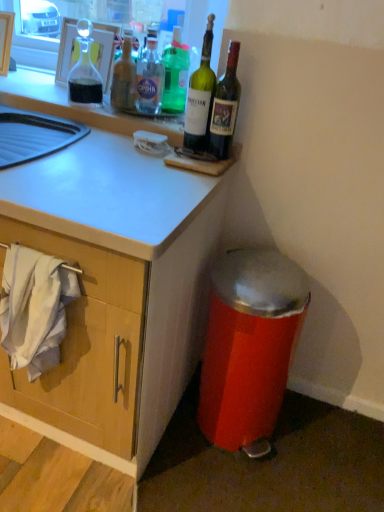
Where is `white fabric at lower left`? This screenshot has height=512, width=384. white fabric at lower left is located at coordinates (35, 308).

The image size is (384, 512). Describe the element at coordinates (35, 308) in the screenshot. I see `white fabric at lower left` at that location.

Locate an element on the screen. The height and width of the screenshot is (512, 384). green glass bottle at upper right, positioned as the 1th bottle in right-to-left order is located at coordinates (225, 106).

What do you see at coordinates (124, 79) in the screenshot? I see `translucent glass bottle at upper center, marked as the 1th bottle in a left-to-right arrangement` at bounding box center [124, 79].

What is the approximate width of white glossy sink at upper left?

The width of white glossy sink at upper left is 19.68 inches.

Image resolution: width=384 pixels, height=512 pixels. Identify the location of clear glass carafe at upper left. 103,49.

Find the location of a particular element. green glass bottle at upper center, the 4th bottle positioned from the left is located at coordinates (200, 97).

In the scene shown: Considering the sizes of green glass bottle at upper center, positioned as the third bottle in left-to-right order, and white fabric at lower left in the image, is green glass bottle at upper center, positioned as the third bottle in left-to-right order, bigger or smaller than white fabric at lower left?

Clearly, green glass bottle at upper center, positioned as the third bottle in left-to-right order, is smaller in size than white fabric at lower left.

Between green glass bottle at upper center, positioned as the 3th bottle in right-to-left order, and white fabric at lower left, which one has smaller width?

With smaller width is white fabric at lower left.

Is green glass bottle at upper center, positioned as the third bottle in left-to-right order, directly adjacent to white fabric at lower left?

They are not placed beside each other.

Do you think green glass bottle at upper center, positioned as the 3th bottle in right-to-left order, is within white fabric at lower left, or outside of it?

green glass bottle at upper center, positioned as the 3th bottle in right-to-left order, is not enclosed by white fabric at lower left.

Is green glass bottle at upper center, positioned as the 3th bottle in right-to-left order, next to white glossy sink at upper left?

No, green glass bottle at upper center, positioned as the 3th bottle in right-to-left order, is not with white glossy sink at upper left.

Which object is positioned more to the right, green glass bottle at upper center, positioned as the 3th bottle in right-to-left order, or white glossy sink at upper left?

Positioned to the right is green glass bottle at upper center, positioned as the 3th bottle in right-to-left order.

From the image's perspective, who appears lower, green glass bottle at upper center, positioned as the 3th bottle in right-to-left order, or white glossy sink at upper left?

white glossy sink at upper left appears lower in the image.

In the scene shown: Considering the sizes of objects clear glass carafe at upper left and translucent glass bottle at upper center, acting as the fifth bottle starting from the right, in the image provided, who is smaller, clear glass carafe at upper left or translucent glass bottle at upper center, acting as the fifth bottle starting from the right,?

translucent glass bottle at upper center, acting as the fifth bottle starting from the right, is smaller.

Which object is more forward, clear glass carafe at upper left or translucent glass bottle at upper center, acting as the fifth bottle starting from the right?

clear glass carafe at upper left is more forward.

Can you confirm if clear glass carafe at upper left is positioned to the right of translucent glass bottle at upper center, marked as the 1th bottle in a left-to-right arrangement?

Incorrect, clear glass carafe at upper left is not on the right side of translucent glass bottle at upper center, marked as the 1th bottle in a left-to-right arrangement.

Can we say clear glass carafe at upper left lies outside translucent glass bottle at upper center, marked as the 1th bottle in a left-to-right arrangement?

Indeed, clear glass carafe at upper left is completely outside translucent glass bottle at upper center, marked as the 1th bottle in a left-to-right arrangement.

Is green glass bottle at upper center, positioned as the 3th bottle in right-to-left order, at the left side of metallic red trash can at lower right?

Correct, you'll find green glass bottle at upper center, positioned as the 3th bottle in right-to-left order, to the left of metallic red trash can at lower right.

Does green glass bottle at upper center, positioned as the 3th bottle in right-to-left order, have a greater width compared to metallic red trash can at lower right?

In fact, green glass bottle at upper center, positioned as the 3th bottle in right-to-left order, might be narrower than metallic red trash can at lower right.

From a real-world perspective, between green glass bottle at upper center, positioned as the 3th bottle in right-to-left order, and metallic red trash can at lower right, who is vertically lower?

metallic red trash can at lower right.

You are a GUI agent. You are given a task and a screenshot of the screen. Output one action in this format:
    pyautogui.click(x=<x>, y=<y>)
    Task: Click on the 5th bottle above the metallic red trash can at lower right (from the image's perspective)
    The width and height of the screenshot is (384, 512).
    Given the screenshot: What is the action you would take?
    pyautogui.click(x=175, y=74)

Is metallic red trash can at lower right aimed at green glass bottle at upper right, positioned as the 1th bottle in right-to-left order?

No, metallic red trash can at lower right is not turned towards green glass bottle at upper right, positioned as the 1th bottle in right-to-left order.

Is metallic red trash can at lower right bigger than green glass bottle at upper right, the fifth bottle from the left?

Yes, metallic red trash can at lower right is bigger than green glass bottle at upper right, the fifth bottle from the left.

Measure the distance from metallic red trash can at lower right to green glass bottle at upper right, the fifth bottle from the left.

metallic red trash can at lower right and green glass bottle at upper right, the fifth bottle from the left, are 22.64 inches apart.

Is metallic red trash can at lower right taller or shorter than green glass bottle at upper right, positioned as the 1th bottle in right-to-left order?

metallic red trash can at lower right is taller than green glass bottle at upper right, positioned as the 1th bottle in right-to-left order.

Which is farther from the camera, (230, 359) or (0, 106)?

The point (0, 106) is more distant.

Based on the photo, from the image's perspective, which is above, metallic red trash can at lower right or white glossy sink at upper left?

white glossy sink at upper left.

Considering the sizes of objects metallic red trash can at lower right and white glossy sink at upper left in the image provided, who is shorter, metallic red trash can at lower right or white glossy sink at upper left?

With less height is white glossy sink at upper left.

Is white glossy sink at upper left at the back of metallic red trash can at lower right?

No.

Is green glass bottle at upper center, the 2th bottle positioned from the right, with green glass bottle at upper right, the fifth bottle from the left?

Answer: Yes, the surface of green glass bottle at upper center, the 2th bottle positioned from the right, is in contact with green glass bottle at upper right, the fifth bottle from the left.

From the picture: Is green glass bottle at upper center, the 2th bottle positioned from the right, positioned beyond the bounds of green glass bottle at upper right, positioned as the 1th bottle in right-to-left order?

Yes, green glass bottle at upper center, the 2th bottle positioned from the right, is located beyond the bounds of green glass bottle at upper right, positioned as the 1th bottle in right-to-left order.

Which is behind, point (188, 104) or point (226, 104)?

The point (188, 104) is farther.

Can you confirm if green glass bottle at upper center, the 4th bottle positioned from the left, is thinner than green glass bottle at upper right, positioned as the 1th bottle in right-to-left order?

Incorrect, the width of green glass bottle at upper center, the 4th bottle positioned from the left, is not less than that of green glass bottle at upper right, positioned as the 1th bottle in right-to-left order.

The width and height of the screenshot is (384, 512). I want to click on laundry in front of the green glass bottle at upper center, positioned as the third bottle in left-to-right order, so click(35, 308).

What are the coordinates of `sink beneath the green glass bottle at upper center, positioned as the third bottle in left-to-right order (from a real-world perspective)` in the screenshot? It's located at (34, 135).

Which object lies nearer to the anchor point green glass bottle at upper center, positioned as the third bottle in left-to-right order, translucent glass bottle at upper center, acting as the fifth bottle starting from the right, or green glass bottle at upper center, the 4th bottle positioned from the left?

translucent glass bottle at upper center, acting as the fifth bottle starting from the right.

Which object lies further to the anchor point green glass bottle at upper center, the 2th bottle positioned from the right, translucent glass bottle at upper center, marked as the 1th bottle in a left-to-right arrangement, or clear glass carafe at upper left?

Based on the image, clear glass carafe at upper left appears to be further to green glass bottle at upper center, the 2th bottle positioned from the right.

Looking at the image, which one is located closer to clear glass bottle at upper center, which is the 2th bottle in left-to-right order, green glass bottle at upper center, the 2th bottle positioned from the right, or translucent glass bottle at upper center, acting as the fifth bottle starting from the right?

translucent glass bottle at upper center, acting as the fifth bottle starting from the right, is positioned closer to the anchor clear glass bottle at upper center, which is the 2th bottle in left-to-right order.

Which object lies further to the anchor point clear glass carafe at upper left, translucent glass bottle at upper center, acting as the fifth bottle starting from the right, or white glossy sink at upper left?

Among the two, white glossy sink at upper left is located further to clear glass carafe at upper left.

Considering their positions, is clear glass carafe at upper left positioned further to green glass bottle at upper center, the 2th bottle positioned from the right, than translucent glass bottle at upper center, marked as the 1th bottle in a left-to-right arrangement?

clear glass carafe at upper left is further to green glass bottle at upper center, the 2th bottle positioned from the right.

Which object lies further to the anchor point translucent glass bottle at upper center, acting as the fifth bottle starting from the right, white fabric at lower left or clear glass carafe at upper left?

Based on the image, white fabric at lower left appears to be further to translucent glass bottle at upper center, acting as the fifth bottle starting from the right.

Based on their spatial positions, is white fabric at lower left or green glass bottle at upper right, the fifth bottle from the left, further from green glass bottle at upper center, positioned as the 3th bottle in right-to-left order?

white fabric at lower left lies further to green glass bottle at upper center, positioned as the 3th bottle in right-to-left order, than the other object.

In the scene shown: Estimate the real-world distances between objects in this image. Which object is closer to translucent glass bottle at upper center, acting as the fifth bottle starting from the right, white glossy sink at upper left or white fabric at lower left?

Based on the image, white glossy sink at upper left appears to be nearer to translucent glass bottle at upper center, acting as the fifth bottle starting from the right.

Where is `sink between clear glass bottle at upper center, which is the 2th bottle in left-to-right order, and metallic red trash can at lower right from top to bottom`? Image resolution: width=384 pixels, height=512 pixels. sink between clear glass bottle at upper center, which is the 2th bottle in left-to-right order, and metallic red trash can at lower right from top to bottom is located at coordinates (34, 135).

The image size is (384, 512). I want to click on bottle between green glass bottle at upper center, the 4th bottle positioned from the left, and clear glass bottle at upper center, which is the 2th bottle in left-to-right order, in the front-back direction, so click(x=225, y=106).

Where is `bottle between green glass bottle at upper center, the 2th bottle positioned from the right, and white fabric at lower left, in the vertical direction`? The width and height of the screenshot is (384, 512). bottle between green glass bottle at upper center, the 2th bottle positioned from the right, and white fabric at lower left, in the vertical direction is located at coordinates (225, 106).

This screenshot has width=384, height=512. What are the coordinates of `sink between green glass bottle at upper center, positioned as the 3th bottle in right-to-left order, and white fabric at lower left, in the vertical direction` in the screenshot? It's located at (34, 135).